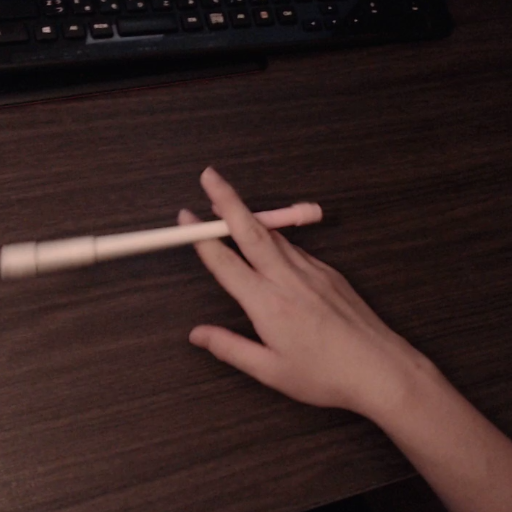
The height and width of the screenshot is (512, 512). Identify the location of pen. (167, 231).